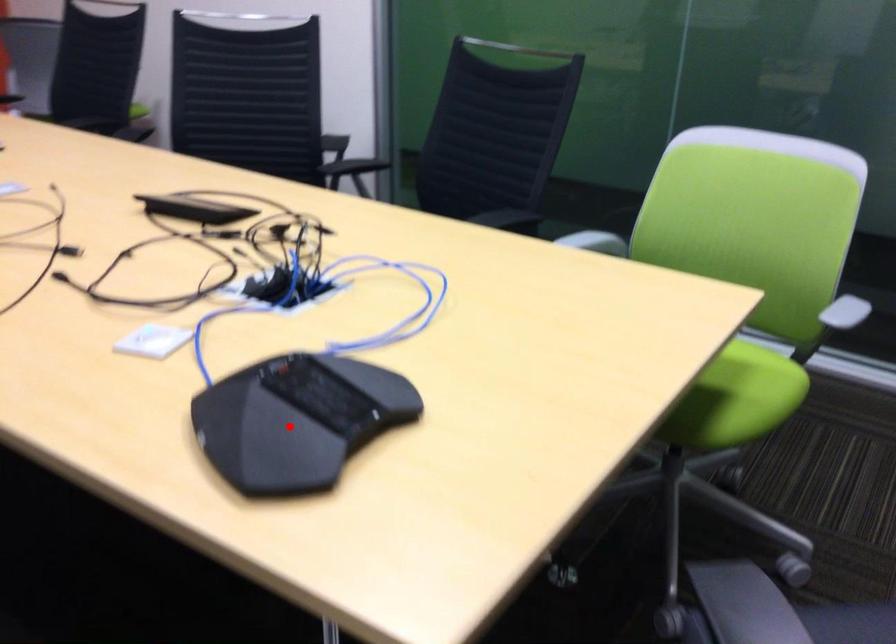
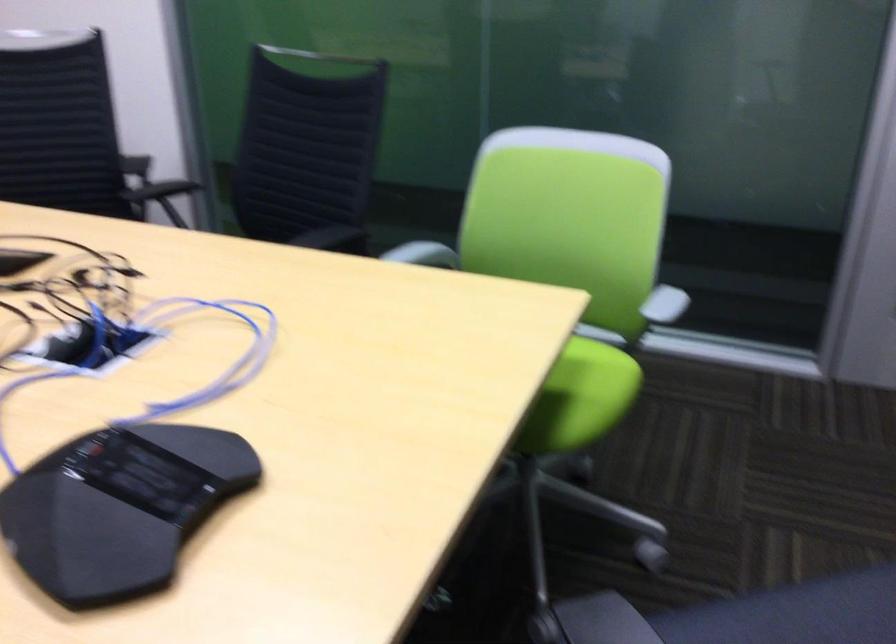
Where in the second image is the point corresponding to the highlighted location from the first image?

(119, 507)